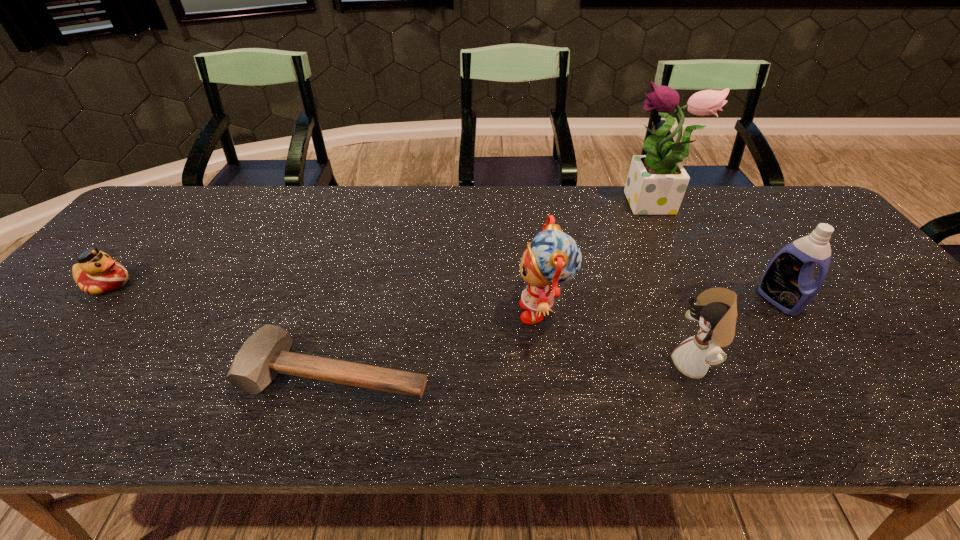
The height and width of the screenshot is (540, 960). Identify the location of free region located 0.060m on the front-facing side of the flower arrangement. (601, 206).

You are a GUI agent. You are given a task and a screenshot of the screen. Output one action in this format:
    pyautogui.click(x=<x>, y=<y>)
    Task: Click on the vacant area situated 0.160m on the front-facing side of the flower arrangement
    
    Given the screenshot: What is the action you would take?
    pyautogui.click(x=568, y=206)

In order to click on vacant area situated on the face of the fourth object from right to left in this screenshot , I will do `click(413, 312)`.

Find the location of a particular element. free space located 0.190m on the face of the fourth object from right to left is located at coordinates (438, 312).

At what (x,y) coordinates should I click in order to perform the action: click on free space located 0.150m on the face of the fourth object from right to left. Please return your answer as a coordinate pair (x, y). Image resolution: width=960 pixels, height=540 pixels. Looking at the image, I should click on (454, 312).

Image resolution: width=960 pixels, height=540 pixels. I want to click on free point located 0.240m on the right of the rightmost object, so click(893, 300).

At what (x,y) coordinates should I click in order to perform the action: click on vacant space located 0.090m at the front face of the right doll. Please return your answer as a coordinate pair (x, y). The height and width of the screenshot is (540, 960). Looking at the image, I should click on (631, 364).

Locate an element on the screen. This screenshot has width=960, height=540. blank space located at the front face of the right doll is located at coordinates (492, 364).

Where is `free space located 0.400m at the front face of the right doll`? free space located 0.400m at the front face of the right doll is located at coordinates (489, 364).

Identify the location of vacant space located 0.340m on the face of the duck. (264, 284).